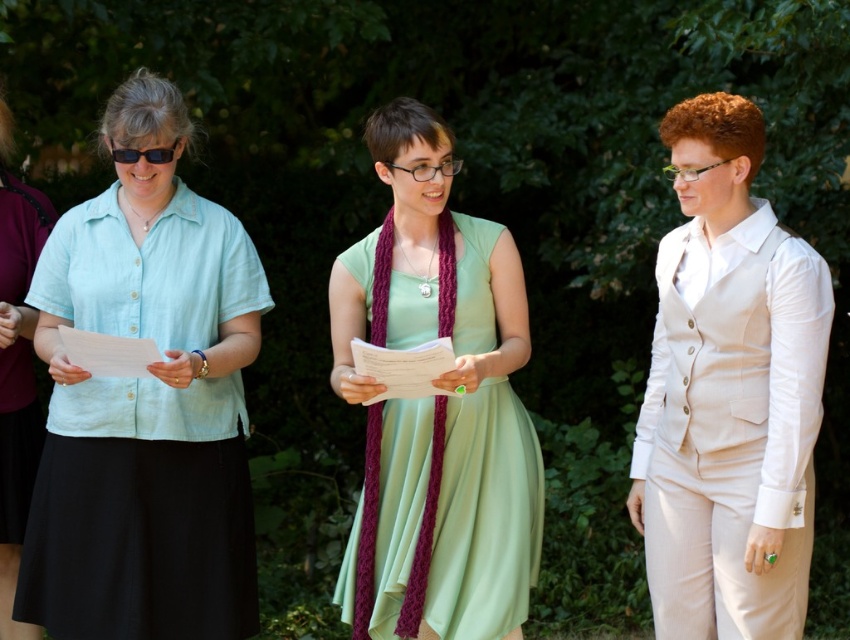
You are a photographer trying to capture a clear shot of both the matte light blue blouse at left and the black plastic goggles at left. Since you want to ensure both are fully visible in your frame, which object should you adjust your focus on to account for their size?

The matte light blue blouse at left might be wider than black plastic goggles at left, so you should focus on the matte light blue blouse at left to ensure it fits within the frame.